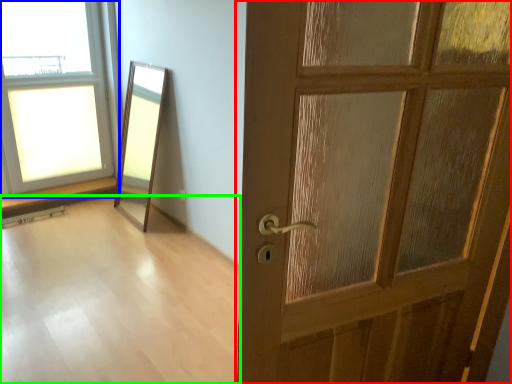
Question: Which object is positioned closest to door (highlighted by a red box)? Select from window (highlighted by a blue box) and corridor (highlighted by a green box).

Choices:
 (A) window
 (B) corridor

Answer: (B)